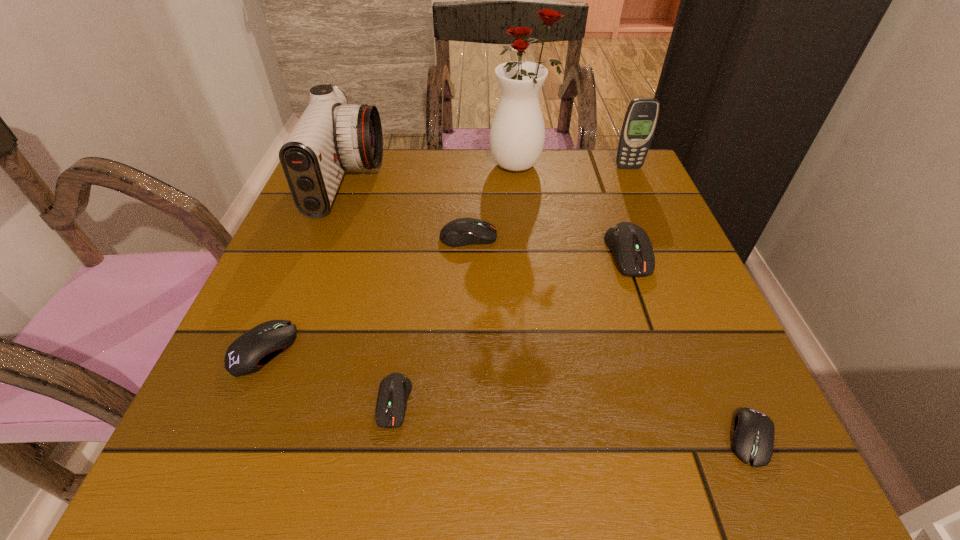
Identify the location of free space between the gray cellular telephone and the leftmost dark computer equipment. (511, 285).

Identify the location of free spot between the biggest dark computer equipment and the second smallest dark computer equipment. (548, 245).

At what (x,y) coordinates should I click in order to perform the action: click on free point between the fourth computer equipment from left to right and the second dark computer equipment from right to left. Please return your answer as a coordinate pair (x, y). This screenshot has width=960, height=540. Looking at the image, I should click on (548, 245).

You are a GUI agent. You are given a task and a screenshot of the screen. Output one action in this format:
    pyautogui.click(x=<x>, y=<y>)
    Task: Click on the vacant region between the smaller black computer equipment and the fourth computer equipment from right to left
    The height and width of the screenshot is (540, 960).
    Given the screenshot: What is the action you would take?
    pyautogui.click(x=572, y=420)

Identify the location of vacant space that's between the bigger black computer equipment and the vase. This screenshot has height=540, width=960. (392, 258).

The width and height of the screenshot is (960, 540). Find the location of `free spot between the right black computer equipment and the gray cellular telephone`. free spot between the right black computer equipment and the gray cellular telephone is located at coordinates (689, 302).

Select which object appears as the fifth closest to the camcorder. Please provide its 2D coordinates. Your answer should be formatted as a tuple, i.e. [(x, y)], where the tuple contains the x and y coordinates of a point satisfying the conditions above.

[(629, 243)]

Where is `object that can be found as the sixth closest to the second computer equipment from left to right`? object that can be found as the sixth closest to the second computer equipment from left to right is located at coordinates (517, 135).

You are a GUI agent. You are given a task and a screenshot of the screen. Output one action in this format:
    pyautogui.click(x=<x>, y=<y>)
    Task: Click on the fourth closest computer equipment to the second computer equipment from left to right
    
    Given the screenshot: What is the action you would take?
    pyautogui.click(x=753, y=439)

Locate an element on the screen. Image resolution: width=960 pixels, height=540 pixels. computer equipment that stands as the closest to the tallest object is located at coordinates (460, 232).